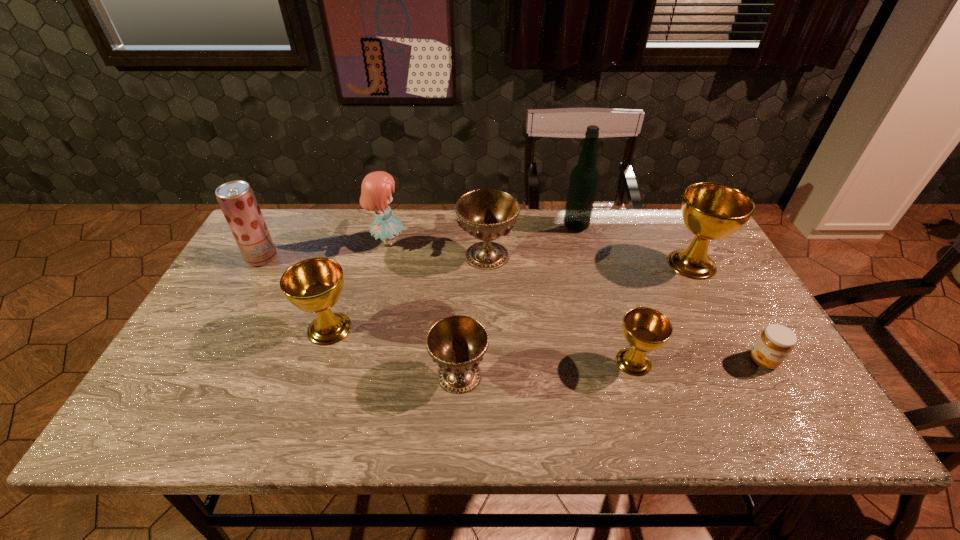
What are the coordinates of `the second gold chalice from right to left` in the screenshot? It's located at (645, 329).

This screenshot has height=540, width=960. In order to click on the smallest gold chalice in this screenshot , I will do `click(645, 329)`.

Where is `the smaller red chalice`? the smaller red chalice is located at coordinates (457, 343).

The height and width of the screenshot is (540, 960). I want to click on jam, so click(x=775, y=343).

Image resolution: width=960 pixels, height=540 pixels. I want to click on the shortest object, so click(775, 343).

Where is `vacant space located on the front of the alcohol`? This screenshot has width=960, height=540. vacant space located on the front of the alcohol is located at coordinates (604, 330).

This screenshot has height=540, width=960. I want to click on free location located on the right of the fruit juice, so click(x=317, y=258).

Find the location of a particular element. vacant region located 0.140m on the front-facing side of the doll is located at coordinates (451, 242).

Image resolution: width=960 pixels, height=540 pixels. Identify the location of vacant region located 0.220m on the front of the farthest gold chalice. (735, 346).

Locate an element on the screen. vacant space located on the left of the bigger red chalice is located at coordinates (411, 255).